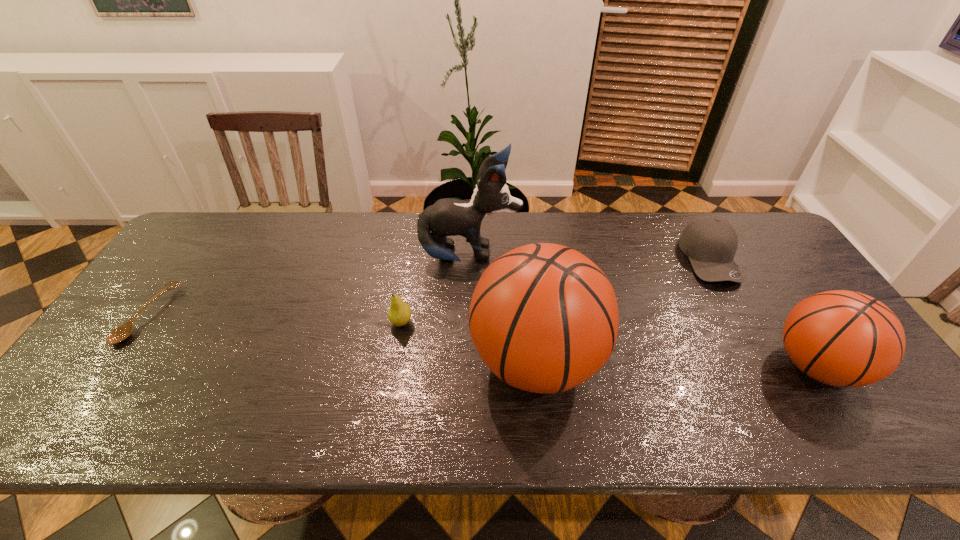
Identify the location of the taller basketball. The height and width of the screenshot is (540, 960). (543, 317).

Locate an element on the screen. the right basketball is located at coordinates (842, 338).

Where is `the fourth shortest object`? The width and height of the screenshot is (960, 540). the fourth shortest object is located at coordinates (842, 338).

Image resolution: width=960 pixels, height=540 pixels. I want to click on baseball cap, so click(x=710, y=242).

What are the coordinates of `ladle` in the screenshot? It's located at (122, 332).

Locate an element on the screen. Image resolution: width=960 pixels, height=540 pixels. the shortest object is located at coordinates (122, 332).

Where is `puppy`? The height and width of the screenshot is (540, 960). puppy is located at coordinates (446, 217).

This screenshot has height=540, width=960. I want to click on pear, so click(x=399, y=313).

Identify the location of vacant space positioned on the left of the taller basketball. Image resolution: width=960 pixels, height=540 pixels. (438, 362).

Where is `vacant region located 0.380m on the left of the right basketball`? vacant region located 0.380m on the left of the right basketball is located at coordinates (614, 367).